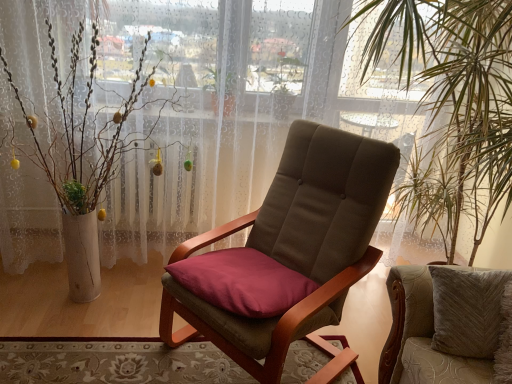
Locate an element on the screen. The width and height of the screenshot is (512, 384). vacant space underneath white textured vase at left (from a real-world perspective) is located at coordinates (77, 307).